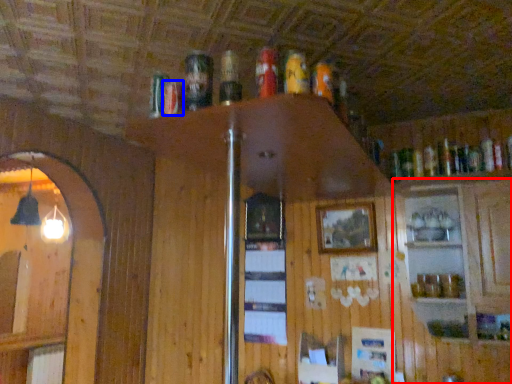
Question: Which object is closer to the camera taking this photo, cabinetry (highlighted by a red box) or beer (highlighted by a blue box)?

Choices:
 (A) cabinetry
 (B) beer

Answer: (B)